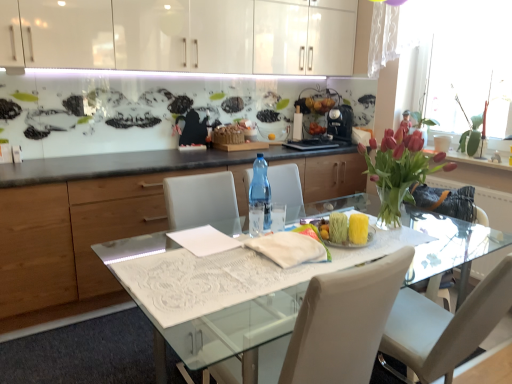
What do you see at coordinates (288, 248) in the screenshot? Image resolution: width=512 pixels, height=384 pixels. I see `white fabric at center` at bounding box center [288, 248].

What do you see at coordinates (260, 197) in the screenshot? I see `transparent plastic bottle at center` at bounding box center [260, 197].

Identify the location of wooden cabinet at left. This screenshot has width=512, height=384. (79, 239).

This screenshot has width=512, height=384. What do you see at coordinates (271, 360) in the screenshot?
I see `white leather chair at center` at bounding box center [271, 360].

Locate an element on the screen. This screenshot has height=384, width=512. transparent glass cup at center is located at coordinates (256, 219).

Can you confirm if transparent plastic bottle at center is smaller than white leather chair at center?

Indeed, transparent plastic bottle at center has a smaller size compared to white leather chair at center.

Is transparent plastic bottle at center taller or shorter than white leather chair at center?

Considering their sizes, transparent plastic bottle at center has less height than white leather chair at center.

Is transparent plastic bottle at center aimed at white leather chair at center?

No, transparent plastic bottle at center does not turn towards white leather chair at center.

Would you say wooden cabinet at left contains pink glass vase at right?

No, pink glass vase at right is not inside wooden cabinet at left.

How much distance is there between wooden cabinet at left and pink glass vase at right?

1.55 meters.

Considering the sizes of objects wooden cabinet at left and pink glass vase at right in the image provided, who is shorter, wooden cabinet at left or pink glass vase at right?

With less height is pink glass vase at right.

From the image's perspective, is wooden cabinet at left above pink glass vase at right?

Actually, wooden cabinet at left appears below pink glass vase at right in the image.

Is transparent glass cup at center positioned with its back to white fabric at center?

No, transparent glass cup at center is not facing the opposite direction of white fabric at center.

Where is `tableware above the white fabric at center (from a real-world perspective)`? This screenshot has width=512, height=384. tableware above the white fabric at center (from a real-world perspective) is located at coordinates (256, 219).

Is there a large distance between transparent glass cup at center and white fabric at center?

No, transparent glass cup at center is not far away from white fabric at center.

How different are the orientations of transparent glass cup at center and white fabric at center in degrees?

There is a 4.73-degree angle between the facing directions of transparent glass cup at center and white fabric at center.

From the image's perspective, is white leather chair at center above or below pink glass vase at right?

white leather chair at center is below pink glass vase at right.

Considering the relative positions of white leather chair at center and pink glass vase at right in the image provided, is white leather chair at center to the right of pink glass vase at right from the viewer's perspective?

Incorrect, white leather chair at center is not on the right side of pink glass vase at right.

Between white leather chair at center and pink glass vase at right, which one is positioned in front?

white leather chair at center is in front.

Considering the relative sizes of white leather chair at center and pink glass vase at right in the image provided, is white leather chair at center thinner than pink glass vase at right?

Incorrect, the width of white leather chair at center is not less than that of pink glass vase at right.

Does transparent glass table at center lie behind pink glass vase at right?

No, transparent glass table at center is in front of pink glass vase at right.

Looking at their sizes, would you say transparent glass table at center is wider or thinner than pink glass vase at right?

Clearly, transparent glass table at center has more width compared to pink glass vase at right.

From a real-world perspective, who is located lower, transparent glass table at center or pink glass vase at right?

transparent glass table at center, from a real-world perspective.

From a real-world perspective, does pink glass vase at right stand above translucent glass vase at upper right?

No, from a real-world perspective, pink glass vase at right is not on top of translucent glass vase at upper right.

Is pink glass vase at right directly adjacent to translucent glass vase at upper right?

No, pink glass vase at right is not with translucent glass vase at upper right.

Is point (401, 170) less distant than point (500, 19)?

Yes, it is.

Does pink glass vase at right turn towards translucent glass vase at upper right?

No, pink glass vase at right does not turn towards translucent glass vase at upper right.

Is the depth of pink glass vase at right greater than that of white fabric at center?

Yes, the depth of pink glass vase at right is greater than that of white fabric at center.

In the scene shown: Does pink glass vase at right appear on the right side of white fabric at center?

Indeed, pink glass vase at right is positioned on the right side of white fabric at center.

Is pink glass vase at right wider than white fabric at center?

Indeed, pink glass vase at right has a greater width compared to white fabric at center.

Is pink glass vase at right not near white fabric at center?

No, pink glass vase at right is in close proximity to white fabric at center.

This screenshot has height=384, width=512. I want to click on chair on the right of transparent plastic bottle at center, so click(271, 360).

You are a GUI agent. You are given a task and a screenshot of the screen. Output one action in this format:
    pyautogui.click(x=<x>, y=<y>)
    Task: Click on the cabinetry below the pink glass vase at right (from a real-world perspective)
    Image resolution: width=512 pixels, height=384 pixels.
    Given the screenshot: What is the action you would take?
    pyautogui.click(x=79, y=239)

Estimate the real-world distances between objects in this image. Which object is further from pink glass vase at right, transparent plastic bottle at center or white fabric at center?

transparent plastic bottle at center lies further to pink glass vase at right than the other object.

Estimate the real-world distances between objects in this image. Which object is closer to transparent glass cup at center, pink glass vase at right or white leather chair at center?

white leather chair at center.

From the image, which object appears to be nearer to pink glass vase at right, translucent glass vase at upper right or white leather chair at center?

white leather chair at center.

Which object lies nearer to the anchor point wooden cabinet at left, pink glass vase at right or white fabric at center?

white fabric at center lies closer to wooden cabinet at left than the other object.

From the image, which object appears to be nearer to white leather chair at center, wooden cabinet at left or transparent plastic bottle at center?

transparent plastic bottle at center is closer to white leather chair at center.

Looking at the image, which one is located further to white fabric at center, transparent glass cup at center or wooden cabinet at left?

wooden cabinet at left.

Looking at the image, which one is located closer to transparent glass table at center, wooden cabinet at left or pink glass vase at right?

Based on the image, pink glass vase at right appears to be nearer to transparent glass table at center.

From the image, which object appears to be farther from transparent plastic bottle at center, white leather chair at center or white fabric at center?

white leather chair at center lies further to transparent plastic bottle at center than the other object.

Locate an element on the screen. This screenshot has width=512, height=384. cloth between pink glass vase at right and transparent glass table at center in the vertical direction is located at coordinates pos(288,248).

Find the location of a particular element. The image size is (512, 384). chair between pink glass vase at right and transparent glass table at center in the up-down direction is located at coordinates (271, 360).

At what (x,y) coordinates should I click in order to perform the action: click on bottle between wooden cabinet at left and translucent glass vase at upper right in the horizontal direction. Please return your answer as a coordinate pair (x, y). The image size is (512, 384). Looking at the image, I should click on (260, 197).

Locate an element on the screen. cloth located between transparent plastic bottle at center and translucent glass vase at upper right in the left-right direction is located at coordinates (288, 248).